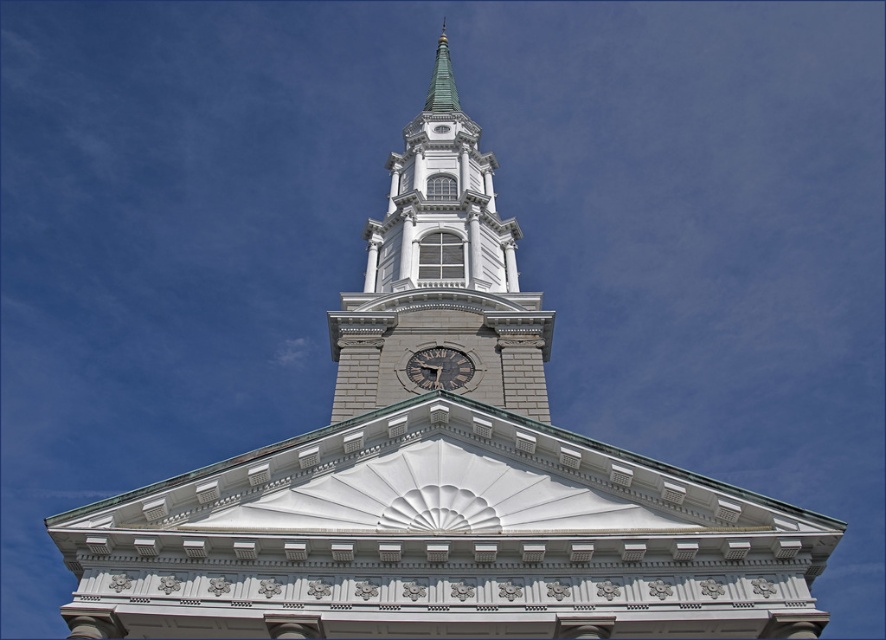
Which is behind, point (483, 342) or point (429, 356)?

The point (483, 342) is behind.

This screenshot has width=886, height=640. What do you see at coordinates (440, 275) in the screenshot? I see `white stone clock tower at center` at bounding box center [440, 275].

Find the location of a particular element. white stone clock tower at center is located at coordinates (440, 275).